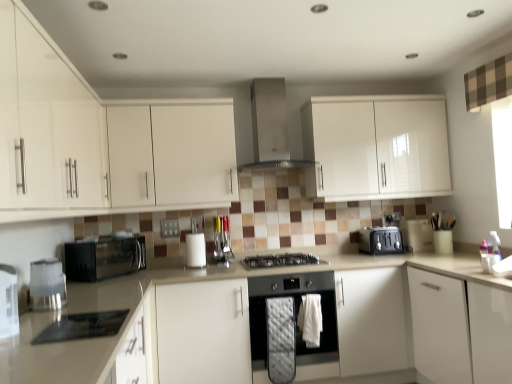
Locate an element on the screen. free point above black glass cooktop at lower left, placed as the fourth appliance when sorted from right to left (from a real-world perspective) is located at coordinates (69, 324).